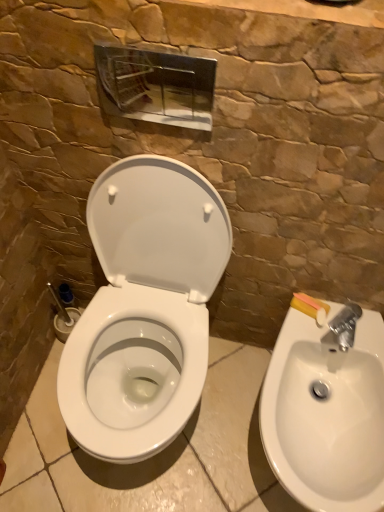
Question: Should I look upward or downward to see white glossy toilet at center?

Choices:
 (A) down
 (B) up

Answer: (A)

Question: From the image's perspective, is white glossy toilet at center over white glossy sink at lower right?

Choices:
 (A) no
 (B) yes

Answer: (B)

Question: Considering the relative sizes of white glossy toilet at center and white glossy sink at lower right in the image provided, is white glossy toilet at center smaller than white glossy sink at lower right?

Choices:
 (A) yes
 (B) no

Answer: (B)

Question: Is white glossy toilet at center at the right side of white glossy sink at lower right?

Choices:
 (A) no
 (B) yes

Answer: (A)

Question: Is white glossy toilet at center shorter than white glossy sink at lower right?

Choices:
 (A) no
 (B) yes

Answer: (A)

Question: Does white glossy toilet at center have a greater height compared to white glossy sink at lower right?

Choices:
 (A) no
 (B) yes

Answer: (B)

Question: Could you tell me if white glossy toilet at center is turned towards white glossy sink at lower right?

Choices:
 (A) yes
 (B) no

Answer: (B)

Question: Is white glossy sink at lower right beside white glossy toilet at center?

Choices:
 (A) yes
 (B) no

Answer: (B)

Question: Considering the relative sizes of white glossy sink at lower right and white glossy toilet at center in the image provided, is white glossy sink at lower right shorter than white glossy toilet at center?

Choices:
 (A) yes
 (B) no

Answer: (A)

Question: Does white glossy sink at lower right have a greater height compared to white glossy toilet at center?

Choices:
 (A) no
 (B) yes

Answer: (A)

Question: Is white glossy sink at lower right far away from white glossy toilet at center?

Choices:
 (A) no
 (B) yes

Answer: (A)

Question: From the image's perspective, would you say white glossy sink at lower right is positioned over white glossy toilet at center?

Choices:
 (A) no
 (B) yes

Answer: (A)

Question: Is white glossy sink at lower right thinner than white glossy toilet at center?

Choices:
 (A) no
 (B) yes

Answer: (A)

Question: From the image's perspective, is white glossy sink at lower right above or below white glossy toilet at center?

Choices:
 (A) below
 (B) above

Answer: (A)